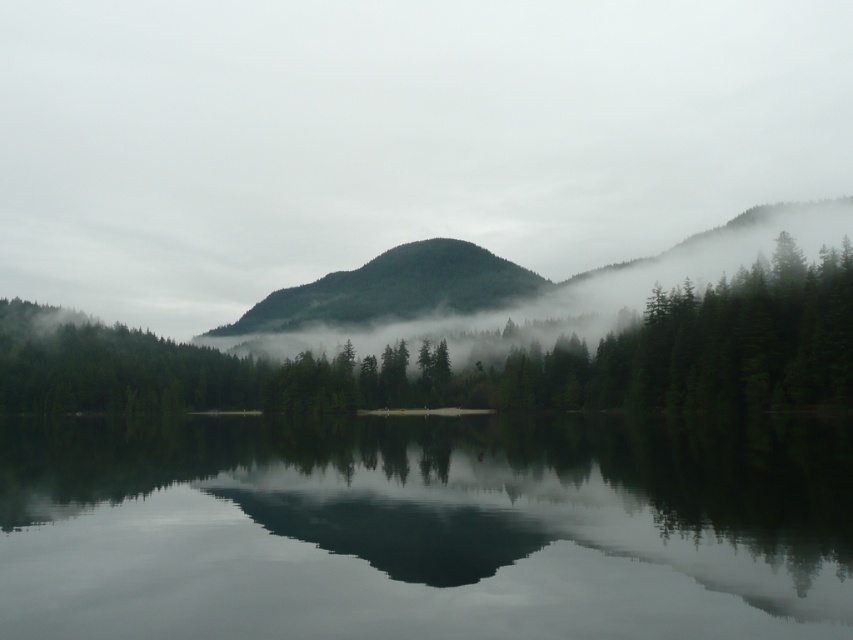
You are an observer standing at the edge of the lake. You see the green matte fog at center and the smooth reflective water at center. Which object is closer to you?

The green matte fog at center is closer to you because it is in front of the smooth reflective water at center.